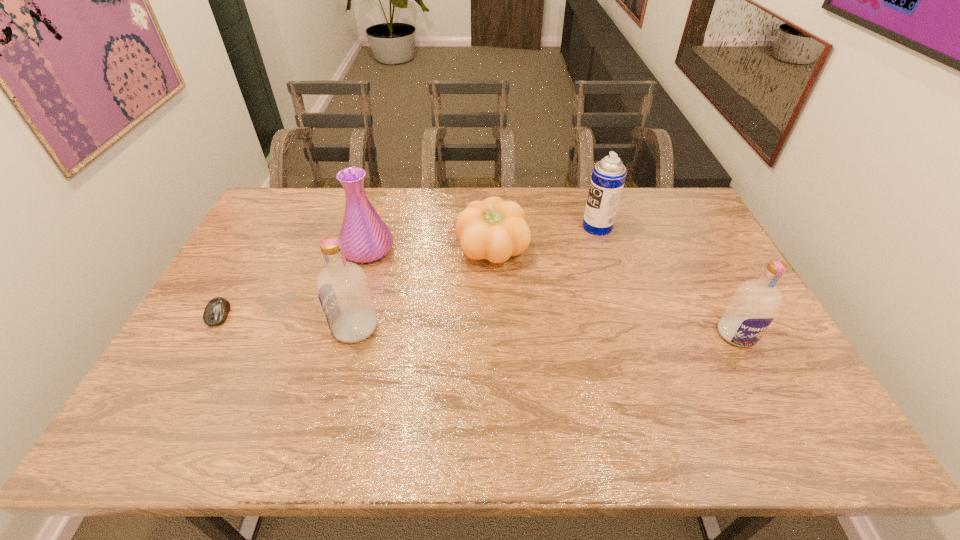
The image size is (960, 540). Identify the location of spot to insert another vodka for uniform distribution. (544, 331).